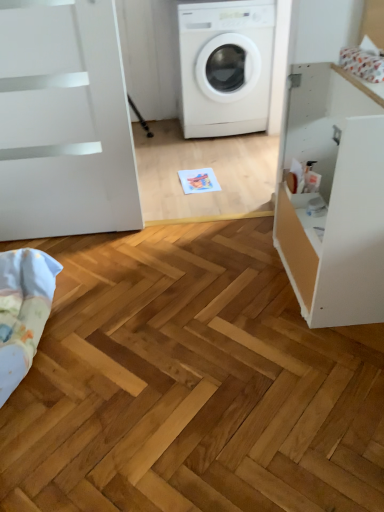
Question: Is white matte washing machine at center at the back of light blue cotton blanket at lower left?

Choices:
 (A) no
 (B) yes

Answer: (A)

Question: Is light blue cotton blanket at lower left to the left of white matte washing machine at center from the viewer's perspective?

Choices:
 (A) no
 (B) yes

Answer: (B)

Question: Considering the relative sizes of light blue cotton blanket at lower left and white matte washing machine at center in the image provided, is light blue cotton blanket at lower left shorter than white matte washing machine at center?

Choices:
 (A) no
 (B) yes

Answer: (B)

Question: From the image's perspective, would you say light blue cotton blanket at lower left is positioned over white matte washing machine at center?

Choices:
 (A) no
 (B) yes

Answer: (A)

Question: Does light blue cotton blanket at lower left have a greater width compared to white matte washing machine at center?

Choices:
 (A) yes
 (B) no

Answer: (B)

Question: In the image, is white matte washing machine at center positioned in front of or behind white matte cabinet at right?

Choices:
 (A) front
 (B) behind

Answer: (B)

Question: In terms of size, does white matte washing machine at center appear bigger or smaller than white matte cabinet at right?

Choices:
 (A) small
 (B) big

Answer: (B)

Question: Is point (235, 117) positioned closer to the camera than point (322, 121)?

Choices:
 (A) closer
 (B) farther

Answer: (B)

Question: From a real-world perspective, is white matte washing machine at center positioned above or below white matte cabinet at right?

Choices:
 (A) above
 (B) below

Answer: (A)

Question: Looking at their shapes, would you say white matte cabinet at right is wider or thinner than light blue cotton blanket at lower left?

Choices:
 (A) wide
 (B) thin

Answer: (A)

Question: From the image's perspective, is white matte cabinet at right above or below light blue cotton blanket at lower left?

Choices:
 (A) above
 (B) below

Answer: (A)

Question: From a real-world perspective, is white matte cabinet at right above or below light blue cotton blanket at lower left?

Choices:
 (A) above
 (B) below

Answer: (A)

Question: Is white matte cabinet at right taller or shorter than light blue cotton blanket at lower left?

Choices:
 (A) short
 (B) tall

Answer: (B)

Question: Considering the positions of white matte washing machine at center and light blue cotton blanket at lower left in the image, is white matte washing machine at center taller or shorter than light blue cotton blanket at lower left?

Choices:
 (A) short
 (B) tall

Answer: (B)

Question: Is white matte washing machine at center bigger or smaller than light blue cotton blanket at lower left?

Choices:
 (A) big
 (B) small

Answer: (A)